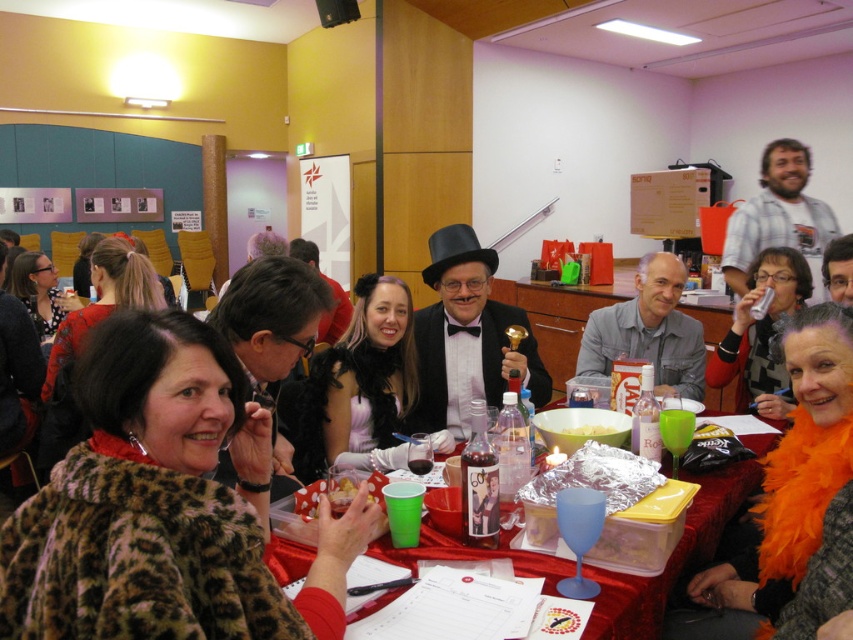
In the scene shown: You are organizing a closet and need to decide where to place the matte black dress at center and the leopard print scarf at lower left. Given their sizes, which item should be placed in a smaller storage space?

The matte black dress at center is smaller than the leopard print scarf at lower left, so the matte black dress at center should be placed in the smaller storage space.

You are a guest at this event and want to take a photo of both the matte black hair at upper right and the white creamy mashed potatoes at table center. Which object should you focus on first if you want to capture both in the same frame without moving the camera?

You should focus on the matte black hair at upper right first because it is larger than the white creamy mashed potatoes at table center, making it easier to fit both into the frame by centering on the larger object.